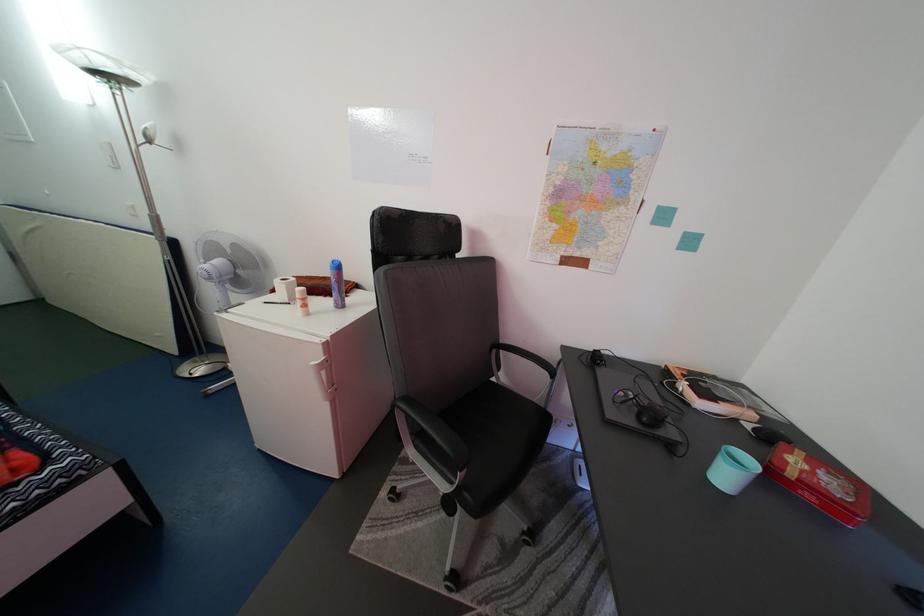
The location [273,302] corresponds to which object?

This point indicates the black pen.